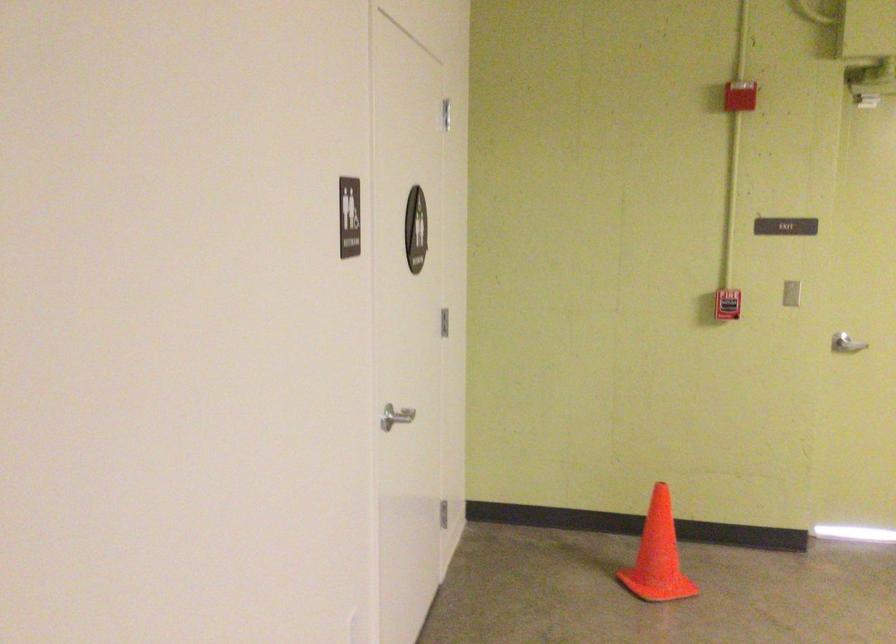
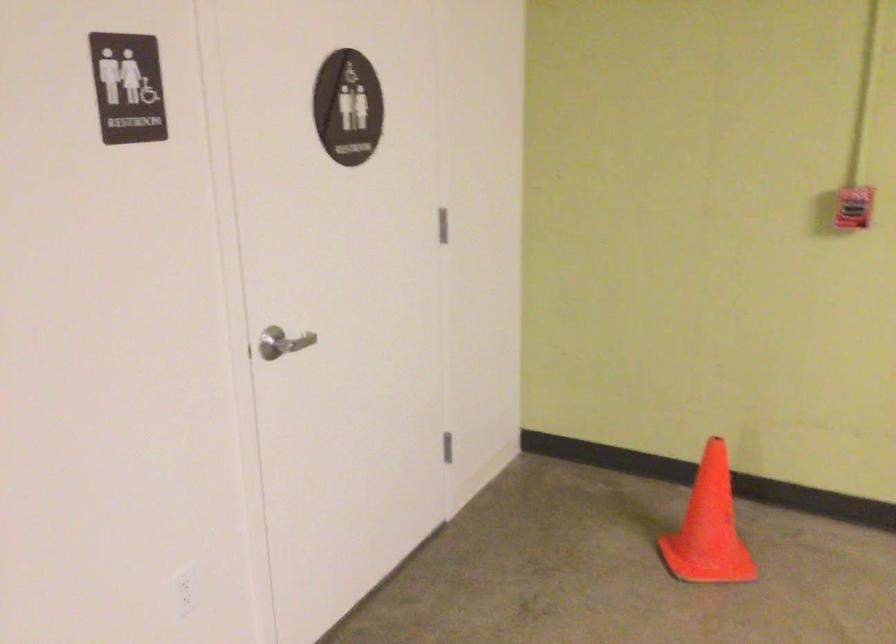
Where in the second image is the point corresponding to (x=743, y=299) from the first image?

(854, 207)